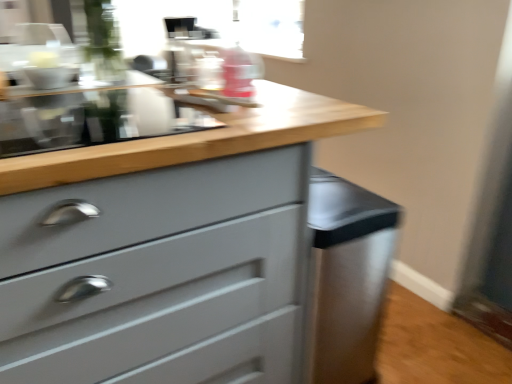
The image size is (512, 384). What do you see at coordinates (349, 275) in the screenshot?
I see `satin silver cabinet at lower right` at bounding box center [349, 275].

Identify the location of satin silver cabinet at lower right. Image resolution: width=512 pixels, height=384 pixels. (349, 275).

You are a GUI agent. You are given a task and a screenshot of the screen. Output one action in this format:
    pyautogui.click(x=<x>, y=<y>)
    Task: Click on the matte gray chest of drawers at center
    
    Given the screenshot: What is the action you would take?
    pyautogui.click(x=159, y=275)

Describe the element at coordinates (159, 275) in the screenshot. I see `matte gray chest of drawers at center` at that location.

In order to click on satin silver cabinet at lower right in this screenshot , I will do `click(349, 275)`.

Considering the positions of objects matte gray chest of drawers at center and satin silver cabinet at lower right in the image provided, who is more to the left, matte gray chest of drawers at center or satin silver cabinet at lower right?

matte gray chest of drawers at center is more to the left.

Is matte gray chest of drawers at center further to camera compared to satin silver cabinet at lower right?

That is False.

Does point (15, 232) lie behind point (383, 276)?

No, it is not.

From the image's perspective, which object appears higher, matte gray chest of drawers at center or satin silver cabinet at lower right?

matte gray chest of drawers at center, from the image's perspective.

From a real-world perspective, who is located lower, matte gray chest of drawers at center or satin silver cabinet at lower right?

satin silver cabinet at lower right, from a real-world perspective.

Does matte gray chest of drawers at center have a lesser width compared to satin silver cabinet at lower right?

Incorrect, the width of matte gray chest of drawers at center is not less than that of satin silver cabinet at lower right.

Consider the image. Considering the relative sizes of matte gray chest of drawers at center and satin silver cabinet at lower right in the image provided, is matte gray chest of drawers at center shorter than satin silver cabinet at lower right?

In fact, matte gray chest of drawers at center may be taller than satin silver cabinet at lower right.

Which of these two, matte gray chest of drawers at center or satin silver cabinet at lower right, is smaller?

satin silver cabinet at lower right.

Is matte gray chest of drawers at center not inside satin silver cabinet at lower right?

Yes, matte gray chest of drawers at center is located beyond the bounds of satin silver cabinet at lower right.

Are matte gray chest of drawers at center and satin silver cabinet at lower right beside each other?

No.

Is matte gray chest of drawers at center oriented away from satin silver cabinet at lower right?

No, matte gray chest of drawers at center's orientation is not away from satin silver cabinet at lower right.

Can you tell me how much matte gray chest of drawers at center and satin silver cabinet at lower right differ in facing direction?

89.7 degrees separate the facing orientations of matte gray chest of drawers at center and satin silver cabinet at lower right.

How far apart are matte gray chest of drawers at center and satin silver cabinet at lower right?

matte gray chest of drawers at center and satin silver cabinet at lower right are 12.48 inches apart.

Identify the location of cabinetry that is on the right side of matte gray chest of drawers at center. The width and height of the screenshot is (512, 384). (349, 275).

In the image, is satin silver cabinet at lower right on the left side or the right side of matte gray chest of drawers at center?

satin silver cabinet at lower right is positioned on matte gray chest of drawers at center's right side.

Which object is closer to the camera taking this photo, satin silver cabinet at lower right or matte gray chest of drawers at center?

matte gray chest of drawers at center.

Is point (321, 374) positioned in front of point (242, 321)?

No, it is not.

From the image's perspective, is satin silver cabinet at lower right beneath matte gray chest of drawers at center?

Correct, satin silver cabinet at lower right appears lower than matte gray chest of drawers at center in the image.

From a real-world perspective, is satin silver cabinet at lower right on top of matte gray chest of drawers at center?

Incorrect, from a real-world perspective, satin silver cabinet at lower right is lower than matte gray chest of drawers at center.

Can you confirm if satin silver cabinet at lower right is thinner than matte gray chest of drawers at center?

Correct, the width of satin silver cabinet at lower right is less than that of matte gray chest of drawers at center.

Is satin silver cabinet at lower right taller than matte gray chest of drawers at center?

No.

Considering the relative sizes of satin silver cabinet at lower right and matte gray chest of drawers at center in the image provided, is satin silver cabinet at lower right smaller than matte gray chest of drawers at center?

Yes, satin silver cabinet at lower right is smaller than matte gray chest of drawers at center.

Can matte gray chest of drawers at center be found inside satin silver cabinet at lower right?

No, matte gray chest of drawers at center is not surrounded by satin silver cabinet at lower right.

In the scene shown: Is satin silver cabinet at lower right not near matte gray chest of drawers at center?

That's not correct — satin silver cabinet at lower right is a little close to matte gray chest of drawers at center.

In the scene shown: Is matte gray chest of drawers at center at the back of satin silver cabinet at lower right?

Yes, satin silver cabinet at lower right is positioned with its back facing matte gray chest of drawers at center.

This screenshot has width=512, height=384. In order to click on cabinetry that is under the matte gray chest of drawers at center (from a real-world perspective) in this screenshot , I will do `click(349, 275)`.

The width and height of the screenshot is (512, 384). Identify the location of the chest of drawers that appears above the satin silver cabinet at lower right (from a real-world perspective). (159, 275).

You are a GUI agent. You are given a task and a screenshot of the screen. Output one action in this format:
    pyautogui.click(x=<x>, y=<y>)
    Task: Click on the chest of drawers above the satin silver cabinet at lower right (from the image's perspective)
    The width and height of the screenshot is (512, 384).
    Given the screenshot: What is the action you would take?
    pyautogui.click(x=159, y=275)